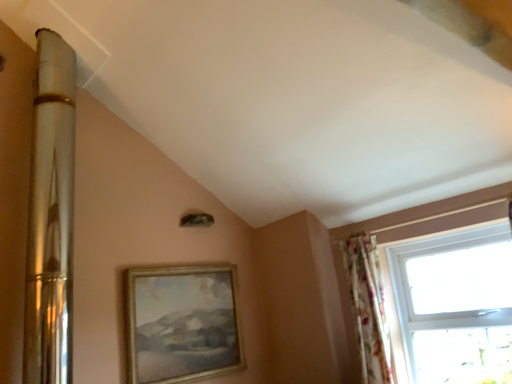
Question: From the image's perspective, relative to floral fabric curtain at right, is transparent glass window at right above or below?

Choices:
 (A) above
 (B) below

Answer: (A)

Question: From a real-world perspective, is transparent glass window at right positioned above or below floral fabric curtain at right?

Choices:
 (A) below
 (B) above

Answer: (A)

Question: Estimate the real-world distances between objects in this image. Which object is farther from the gold/golden wood picture frame at center?

Choices:
 (A) floral fabric curtain at right
 (B) transparent glass window at right

Answer: (B)

Question: Estimate the real-world distances between objects in this image. Which object is farther from the transparent glass window at right?

Choices:
 (A) floral fabric curtain at right
 (B) gold/golden wood picture frame at center

Answer: (B)